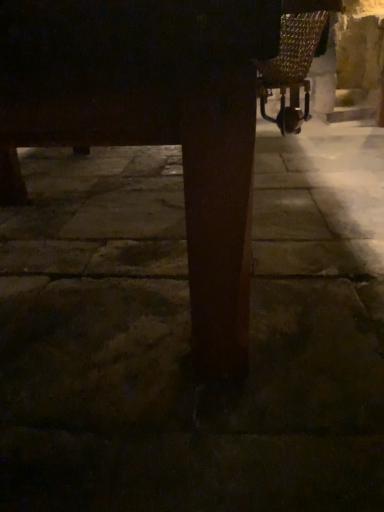
Image resolution: width=384 pixels, height=512 pixels. I want to click on rusty metal pole at center, so click(x=154, y=121).

What do you see at coordinates (154, 121) in the screenshot? I see `rusty metal pole at center` at bounding box center [154, 121].

Find the location of a particular element. This screenshot has height=512, width=384. rusty metal pole at center is located at coordinates (154, 121).